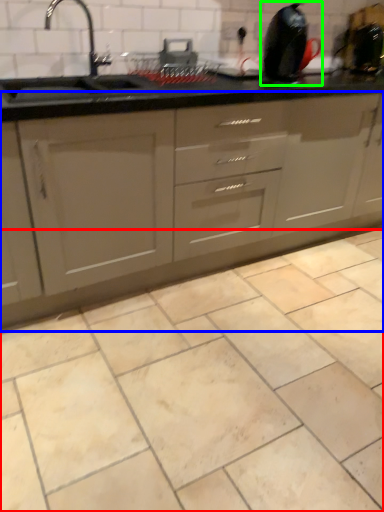
Question: Estimate the real-world distances between objects in this image. Which object is farther from ceramic tile (highlighted by a red box), cabinetry (highlighted by a blue box) or appliance (highlighted by a green box)?

Choices:
 (A) cabinetry
 (B) appliance

Answer: (B)